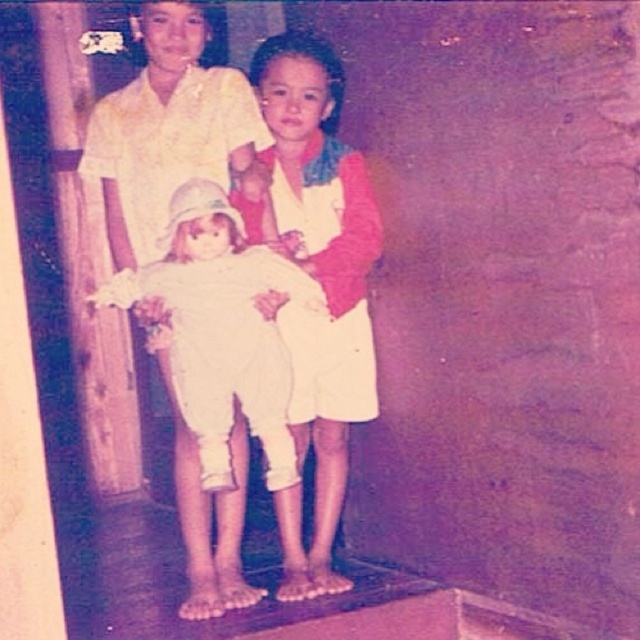
Is point (246, 218) positioned before point (200, 109)?

No, it is behind (200, 109).

Does white cotton dress at center appear over white cloth doll at center?

Incorrect, white cotton dress at center is not positioned above white cloth doll at center.

You are a GUI agent. You are given a task and a screenshot of the screen. Output one action in this format:
    pyautogui.click(x=<x>, y=<y>)
    Task: Click on the white cotton dress at center
    
    Given the screenshot: What is the action you would take?
    pyautogui.click(x=317, y=280)